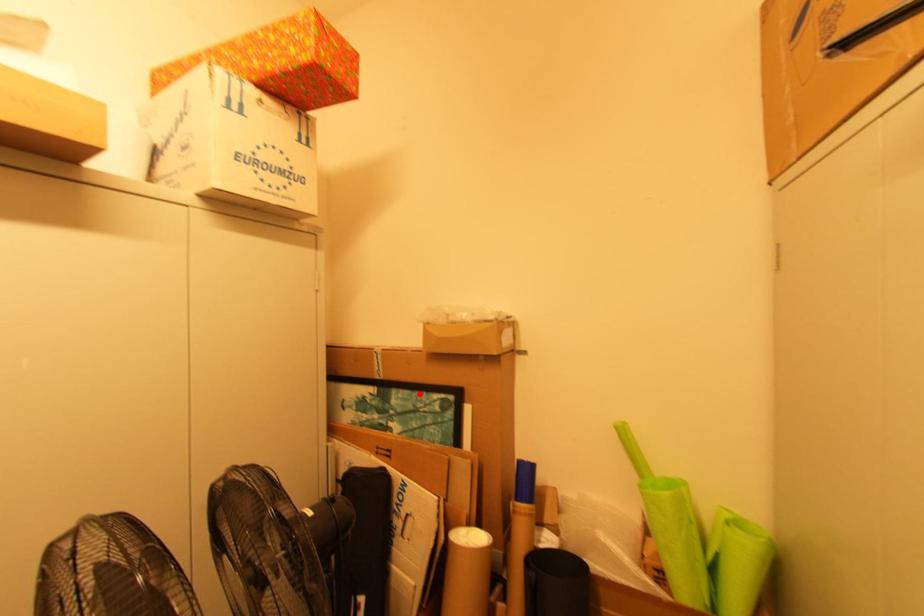
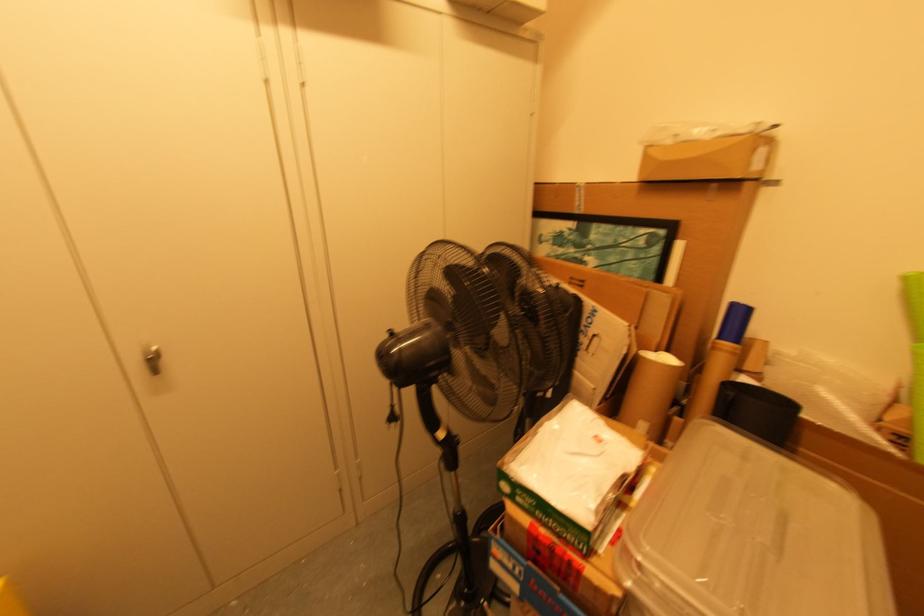
The point at the highlighted location is marked in the first image. Where is the corresponding point in the second image?

(622, 228)